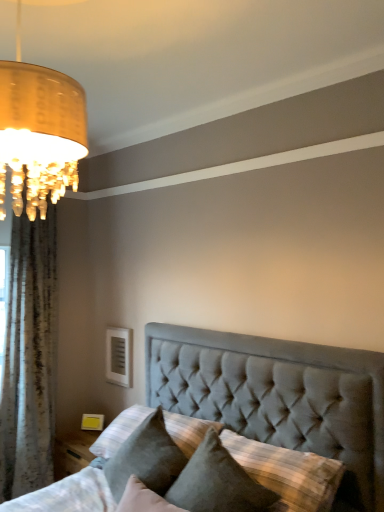
Question: Is suede pillow at center, the 1th pillow in the right-to-left sequence, bigger than velvet gray pillow at lower center, the 1th pillow when ordered from left to right?

Choices:
 (A) no
 (B) yes

Answer: (B)

Question: Considering the relative sizes of suede pillow at center, the 1th pillow in the right-to-left sequence, and velvet gray pillow at lower center, the 1th pillow when ordered from left to right, in the image provided, is suede pillow at center, the 1th pillow in the right-to-left sequence, wider than velvet gray pillow at lower center, the 1th pillow when ordered from left to right,?

Choices:
 (A) no
 (B) yes

Answer: (B)

Question: Is suede pillow at center, marked as the second pillow in a left-to-right arrangement, at the left side of velvet gray pillow at lower center, the second pillow viewed from the right?

Choices:
 (A) yes
 (B) no

Answer: (B)

Question: Would you say suede pillow at center, the 1th pillow in the right-to-left sequence, is outside velvet gray pillow at lower center, the second pillow viewed from the right?

Choices:
 (A) no
 (B) yes

Answer: (B)

Question: Could you tell me if suede pillow at center, the 1th pillow in the right-to-left sequence, is turned towards velvet gray pillow at lower center, the 1th pillow when ordered from left to right?

Choices:
 (A) no
 (B) yes

Answer: (A)

Question: Does point (125, 480) appear closer or farther from the camera than point (173, 489)?

Choices:
 (A) farther
 (B) closer

Answer: (A)

Question: In terms of height, does velvet gray pillow at lower center, the 1th pillow when ordered from left to right, look taller or shorter compared to suede pillow at center, marked as the second pillow in a left-to-right arrangement?

Choices:
 (A) short
 (B) tall

Answer: (A)

Question: Considering their positions, is velvet gray pillow at lower center, the 1th pillow when ordered from left to right, located in front of or behind suede pillow at center, the 1th pillow in the right-to-left sequence?

Choices:
 (A) behind
 (B) front

Answer: (A)

Question: Looking at their shapes, would you say velvet gray pillow at lower center, the second pillow viewed from the right, is wider or thinner than suede pillow at center, marked as the second pillow in a left-to-right arrangement?

Choices:
 (A) thin
 (B) wide

Answer: (A)

Question: Is point (253, 480) closer or farther from the camera than point (14, 408)?

Choices:
 (A) closer
 (B) farther

Answer: (A)

Question: Considering their positions, is suede pillow at center, the 1th pillow in the right-to-left sequence, located in front of or behind white textured curtain at left?

Choices:
 (A) front
 (B) behind

Answer: (A)

Question: Is suede pillow at center, the 1th pillow in the right-to-left sequence, taller or shorter than white textured curtain at left?

Choices:
 (A) tall
 (B) short

Answer: (B)

Question: From a real-world perspective, is suede pillow at center, the 1th pillow in the right-to-left sequence, above or below white textured curtain at left?

Choices:
 (A) below
 (B) above

Answer: (A)

Question: In terms of height, does white textured curtain at left look taller or shorter compared to suede pillow at center, the 1th pillow in the right-to-left sequence?

Choices:
 (A) short
 (B) tall

Answer: (B)

Question: From a real-world perspective, relative to suede pillow at center, the 1th pillow in the right-to-left sequence, is white textured curtain at left vertically above or below?

Choices:
 (A) above
 (B) below

Answer: (A)